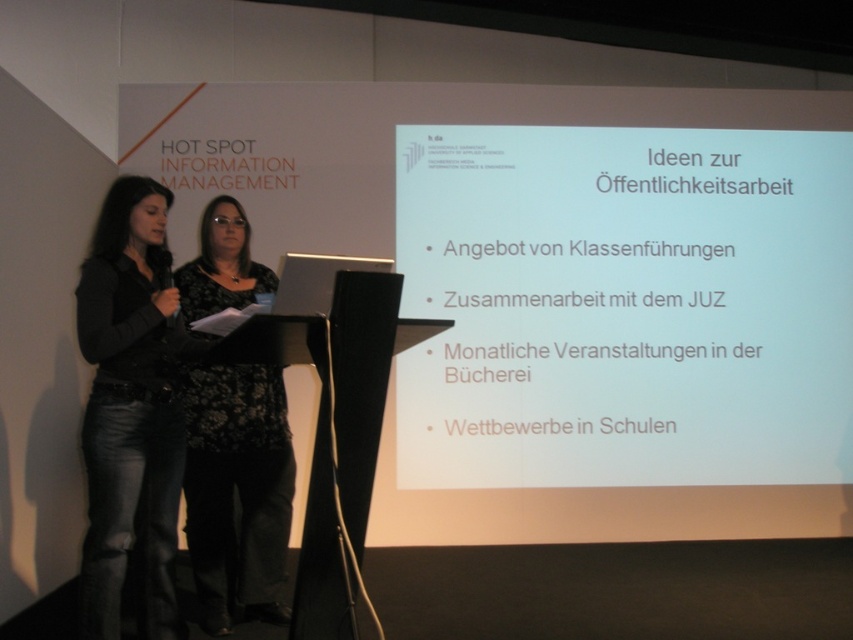
Who is more distant from viewer, (131, 400) or (218, 564)?

The point (218, 564) is more distant.

Can you confirm if denim jeans at left is positioned below black floral dress at center?

No, denim jeans at left is not below black floral dress at center.

What do you see at coordinates (129, 412) in the screenshot? This screenshot has width=853, height=640. I see `denim jeans at left` at bounding box center [129, 412].

Find the location of a particular element. denim jeans at left is located at coordinates (129, 412).

Is white matte projector screen at upper center positioned behind denim jeans at left?

That is True.

Between point (753, 376) and point (113, 356), which one is positioned behind?

Positioned behind is point (753, 376).

Locate an element on the screen. The image size is (853, 640). white matte projector screen at upper center is located at coordinates (625, 307).

Which is above, white matte projector screen at upper center or black floral dress at center?

white matte projector screen at upper center is above.

Is white matte projector screen at upper center behind black floral dress at center?

That is True.

The height and width of the screenshot is (640, 853). Find the location of `white matte projector screen at upper center`. white matte projector screen at upper center is located at coordinates (625, 307).